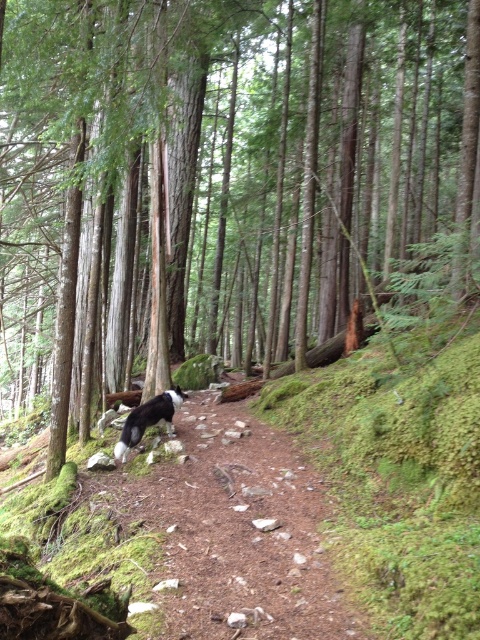
Is brown dirt trail at center taller than black and white fur at center?

No, brown dirt trail at center is not taller than black and white fur at center.

Can you confirm if brown dirt trail at center is positioned above black and white fur at center?

No, brown dirt trail at center is not above black and white fur at center.

Between point (288, 556) and point (170, 413), which one is positioned in front?

Positioned in front is point (288, 556).

This screenshot has width=480, height=640. Identify the location of brown dirt trail at center. (239, 531).